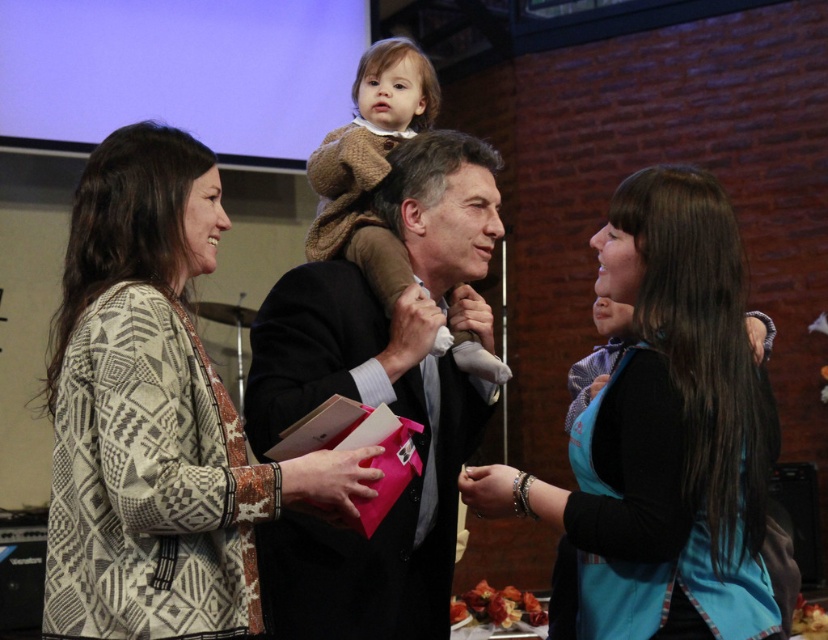
Question: Which point is farther to the camera?

Choices:
 (A) patterned knit sweater at left
 (B) dark suit at center
 (C) black fabric apron at right

Answer: (B)

Question: Which of the following is the farthest from the observer?

Choices:
 (A) (623, 448)
 (B) (410, 314)

Answer: (B)

Question: Is dark suit at center closer to camera compared to brown knitted sweater at center?

Choices:
 (A) no
 (B) yes

Answer: (B)

Question: Considering the relative positions of patterned knit sweater at left and brown knitted sweater at center in the image provided, where is patterned knit sweater at left located with respect to brown knitted sweater at center?

Choices:
 (A) left
 (B) right

Answer: (A)

Question: Does patterned knit sweater at left lie behind black fabric apron at right?

Choices:
 (A) yes
 (B) no

Answer: (B)

Question: Which of the following is the closest to the observer?

Choices:
 (A) (398, 294)
 (B) (354, 269)

Answer: (A)